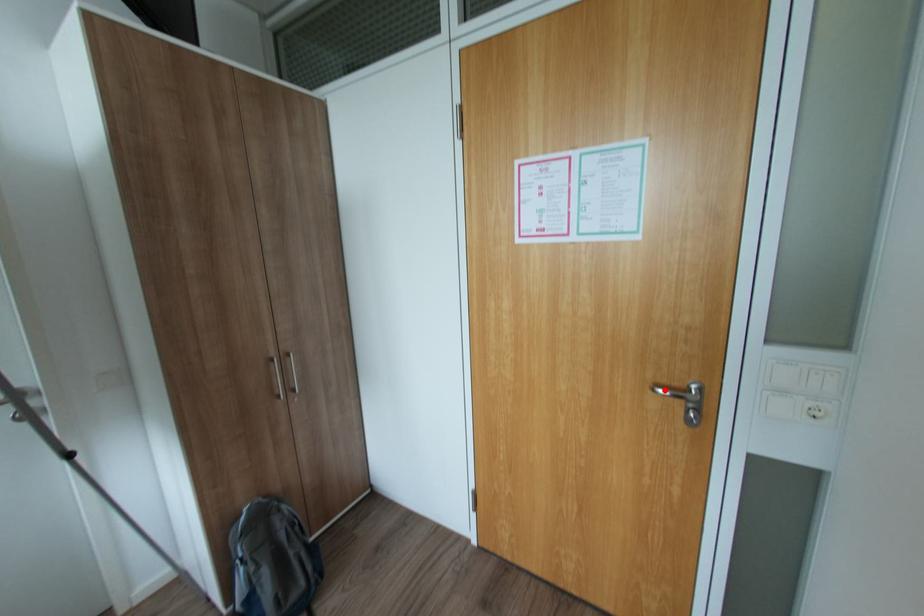
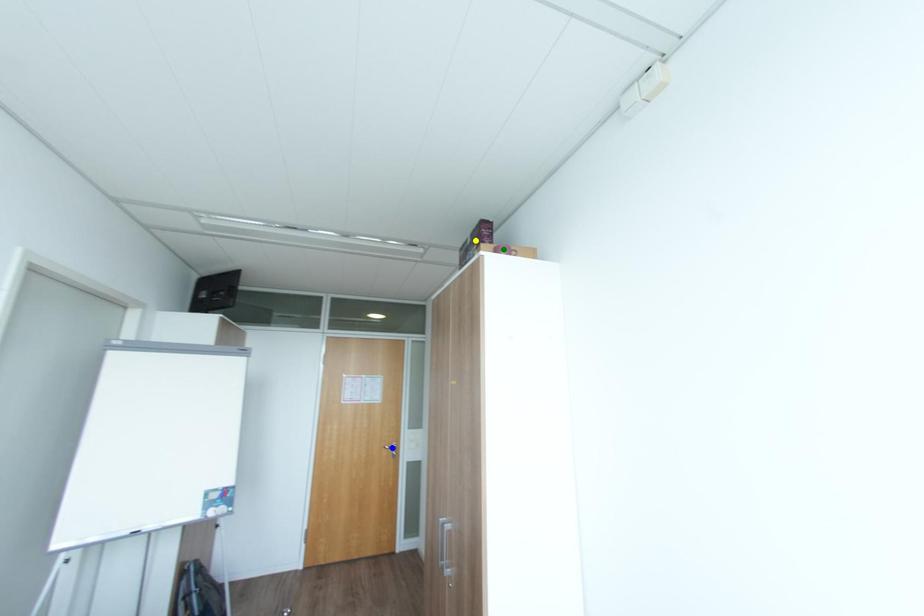
Question: I am providing you with two images of the same scene from different viewpoints. A red point is marked on the first image. You are given multiple points on the second image. Can you choose the point in image 2 that corresponds to the point in image 1?

Choices:
 (A) yellow point
 (B) green point
 (C) blue point

Answer: (C)